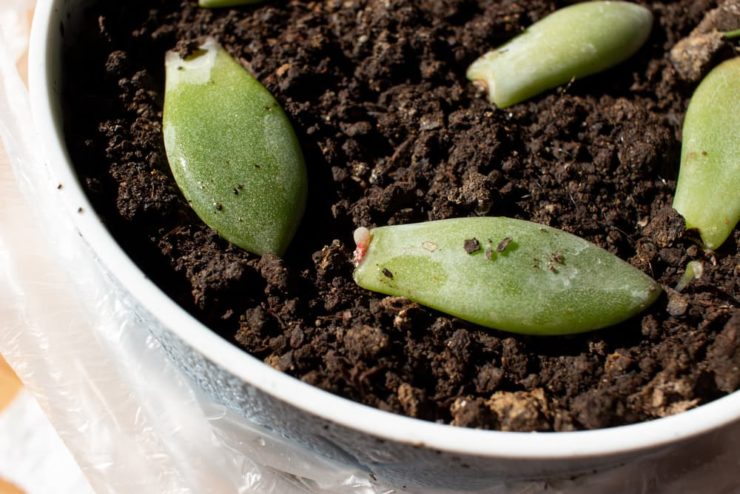
Where is `rightmost succulent`? rightmost succulent is located at coordinates (689, 156).